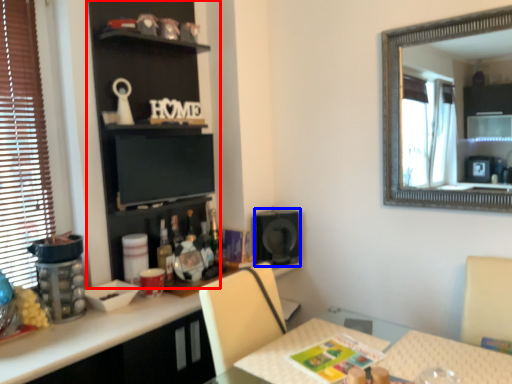
Question: Which of the following is the closest to the observer, bookshelf (highlighted by a red box) or speaker (highlighted by a blue box)?

Choices:
 (A) bookshelf
 (B) speaker

Answer: (A)